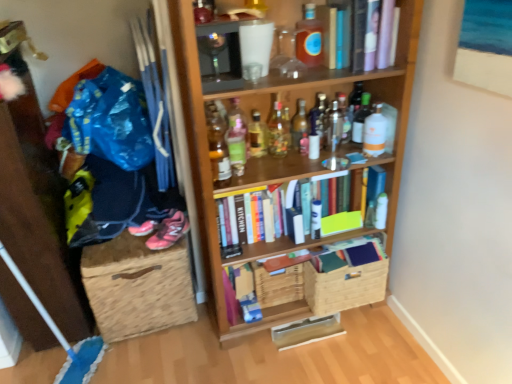
You are a GUI agent. You are given a task and a screenshot of the screen. Output one action in this format:
    pyautogui.click(x=<x>, y=<y>)
    Task: Click on the free space in front of translucent glass bottle at center, arranged as the 4th bottle when viewed from the left
    Image resolution: width=512 pixels, height=384 pixels.
    Given the screenshot: What is the action you would take?
    pyautogui.click(x=273, y=173)